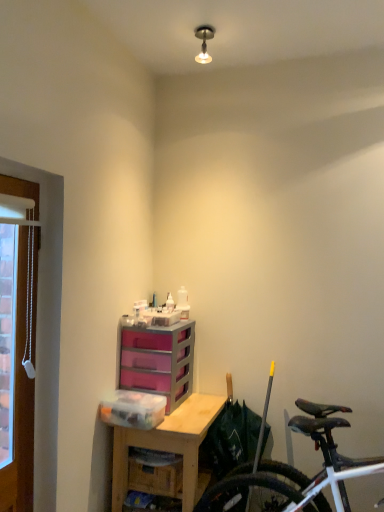
Question: Considering the relative positions of metallic ceiling light at upper center and wooden desk at center in the image provided, is metallic ceiling light at upper center to the left or to the right of wooden desk at center?

Choices:
 (A) left
 (B) right

Answer: (B)

Question: Considering the positions of metallic ceiling light at upper center and wooden desk at center in the image, is metallic ceiling light at upper center wider or thinner than wooden desk at center?

Choices:
 (A) thin
 (B) wide

Answer: (A)

Question: Which is farther from the brown wooden door at left?

Choices:
 (A) wooden desk at center
 (B) clear plastic container at lower center
 (C) metallic ceiling light at upper center
 (D) white matte bicycle at lower right
 (E) pink plastic chest of drawers at center

Answer: (C)

Question: Which object is positioned farthest from the wooden desk at center?

Choices:
 (A) clear plastic container at lower center
 (B) pink plastic chest of drawers at center
 (C) white matte bicycle at lower right
 (D) metallic ceiling light at upper center
 (E) brown wooden door at left

Answer: (D)